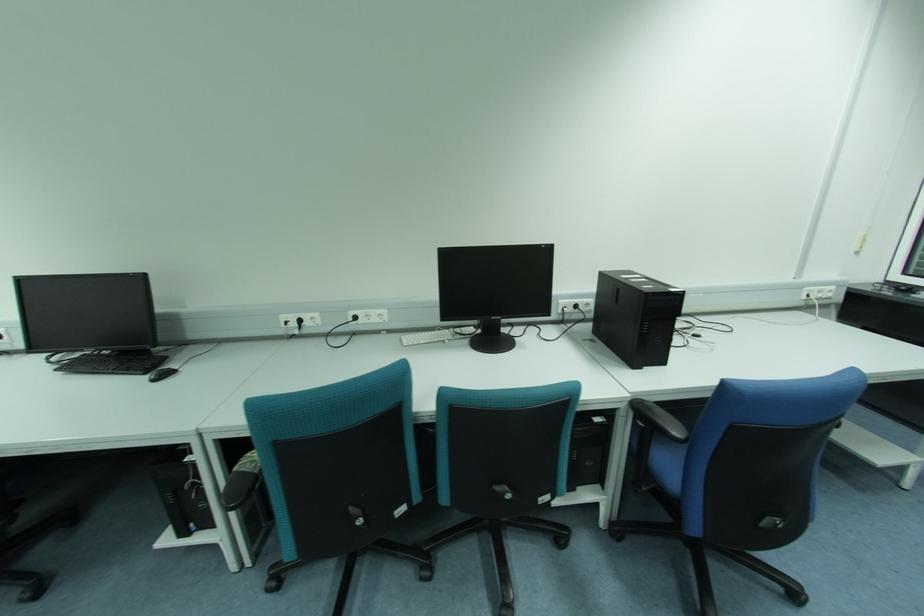
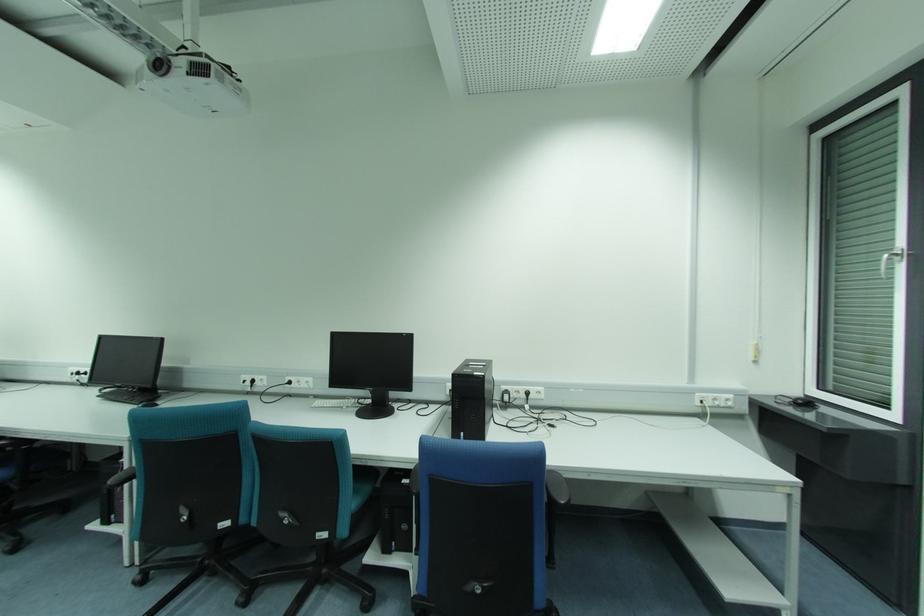
The point at (300, 322) is marked in the first image. Where is the corresponding point in the second image?

(253, 381)